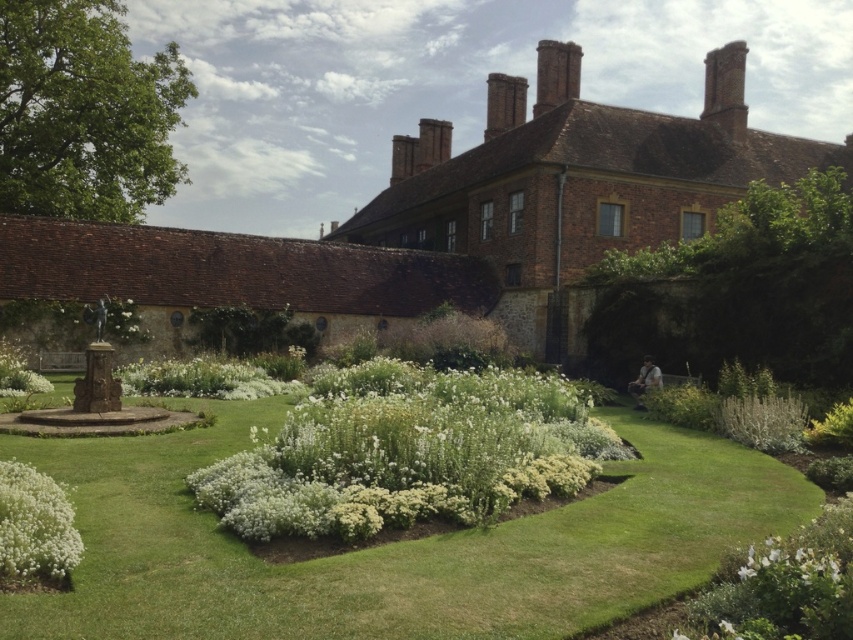
Question: Does green fuzzy bush at lower right have a larger size compared to white matte flower at lower right?

Choices:
 (A) yes
 (B) no

Answer: (A)

Question: Among these points, which one is nearest to the camera?

Choices:
 (A) (767, 428)
 (B) (38, 609)
 (C) (202, 358)
 (D) (15, 522)

Answer: (B)

Question: Is white fluffy bush at center to the right of green fuzzy bush at lower right from the viewer's perspective?

Choices:
 (A) yes
 (B) no

Answer: (B)

Question: Can you confirm if green grass at center is thinner than white fluffy flowers at center?

Choices:
 (A) no
 (B) yes

Answer: (A)

Question: Which object appears closest to the camera in this image?

Choices:
 (A) white fluffy bush at lower left
 (B) green grass at center
 (C) white fluffy bush at center

Answer: (B)

Question: Which is nearer to the green grass at center?

Choices:
 (A) green fuzzy bush at lower right
 (B) white fluffy bush at lower left

Answer: (B)